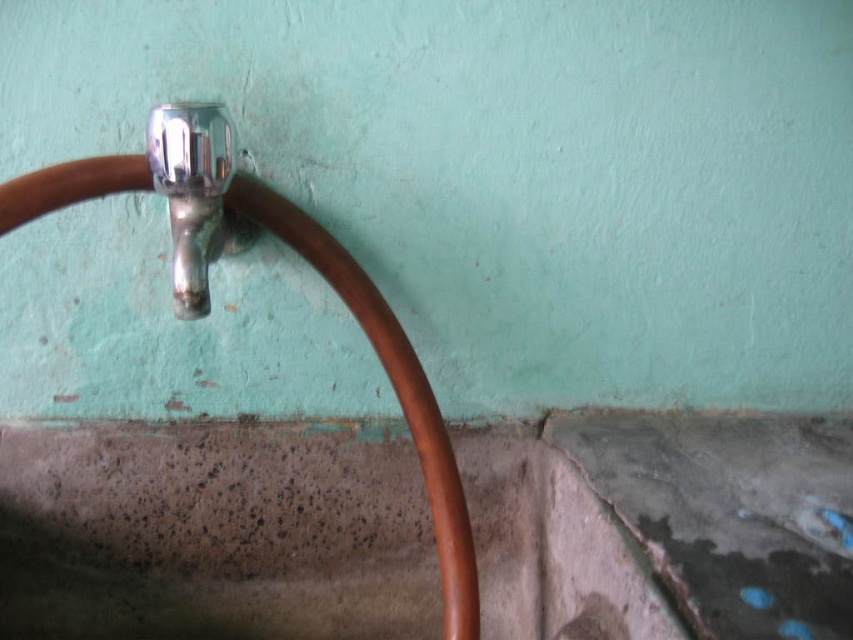
You are trying to locate the shiny copper hose at upper left and the polished chrome faucet at upper left in the scene. Based on their positions, which one is positioned to the right side of the other?

The shiny copper hose at upper left is to the right of the polished chrome faucet at upper left.

You are a plumber inspecting the plumbing fixtures in a bathroom. You see the shiny copper hose at upper left and the polished chrome faucet at upper left. Which object has a larger diameter?

The shiny copper hose at upper left might be wider than polished chrome faucet at upper left according to the description.

You are a plumber inspecting the plumbing fixtures in a bathroom. You see the shiny copper hose at upper left and the polished chrome faucet at upper left. Which one is positioned lower in the scene?

The shiny copper hose at upper left is located below the polished chrome faucet at upper left, so the shiny copper hose at upper left is positioned lower in the scene.